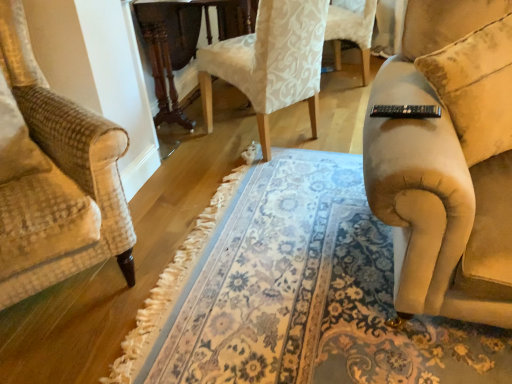
Find the location of a particular element. vacant area on top of floral carpet at center (from a real-world perspective) is located at coordinates (223, 267).